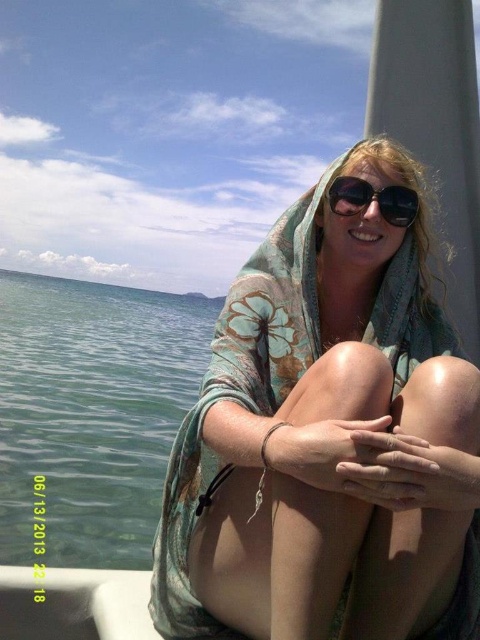
Question: Is clear blue water at left further to camera compared to sunglasses at center?

Choices:
 (A) yes
 (B) no

Answer: (A)

Question: Which object appears farthest from the camera in this image?

Choices:
 (A) floral chiffon scarf at center
 (B) sunglasses at center

Answer: (B)

Question: Can you confirm if floral chiffon scarf at center is positioned above sunglasses at center?

Choices:
 (A) no
 (B) yes

Answer: (A)

Question: Does clear blue water at left have a larger size compared to sunglasses at center?

Choices:
 (A) yes
 (B) no

Answer: (A)

Question: Estimate the real-world distances between objects in this image. Which object is farther from the floral chiffon scarf at center?

Choices:
 (A) clear blue water at left
 (B) sunglasses at center

Answer: (A)

Question: Based on their relative distances, which object is farther from the clear blue water at left?

Choices:
 (A) sunglasses at center
 (B) floral chiffon scarf at center

Answer: (A)